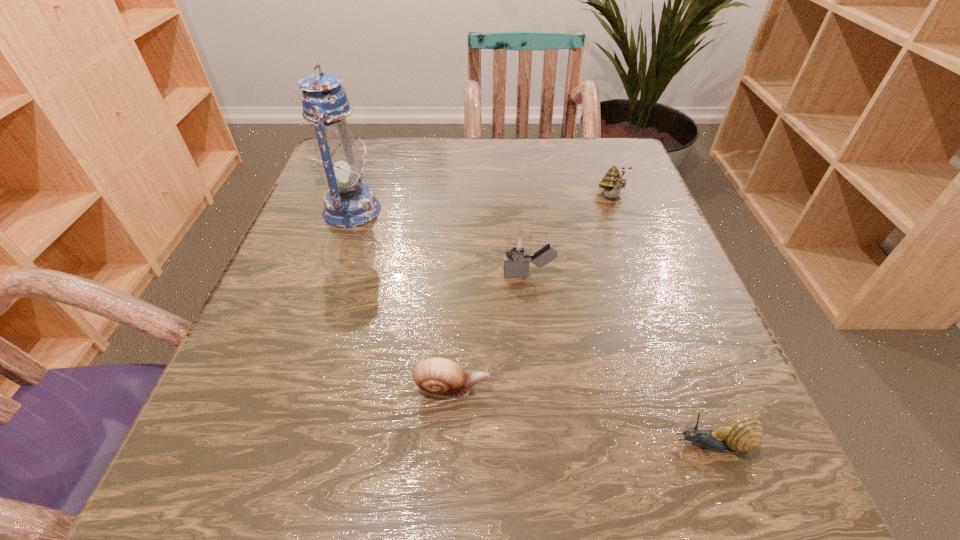
At what (x,y) coordinates should I click in order to perform the action: click on the leftmost object. Please return your answer as a coordinate pair (x, y). Looking at the image, I should click on (349, 203).

Where is `lantern`? lantern is located at coordinates (349, 203).

What are the coordinates of `the tallest escargot` in the screenshot? It's located at (612, 182).

At what (x,y) coordinates should I click in order to perform the action: click on the third object from right to left. Please return your answer as a coordinate pair (x, y). Looking at the image, I should click on (x=516, y=264).

Identify the location of igniter. (516, 264).

The image size is (960, 540). I want to click on the second farthest escargot, so click(x=440, y=377).

Locate an element on the screen. This screenshot has height=540, width=960. the fourth object from right to left is located at coordinates (440, 377).

Where is `the nearest object`? The width and height of the screenshot is (960, 540). the nearest object is located at coordinates (742, 433).

The image size is (960, 540). Identify the location of free location located on the front-facing side of the tallest object. (498, 210).

You are a GUI agent. You are given a task and a screenshot of the screen. Output one action in this format:
    pyautogui.click(x=<x>, y=<y>)
    Task: Click on the vacant space located on the face of the farthest escargot
    This screenshot has height=540, width=960.
    Given the screenshot: What is the action you would take?
    pyautogui.click(x=631, y=247)